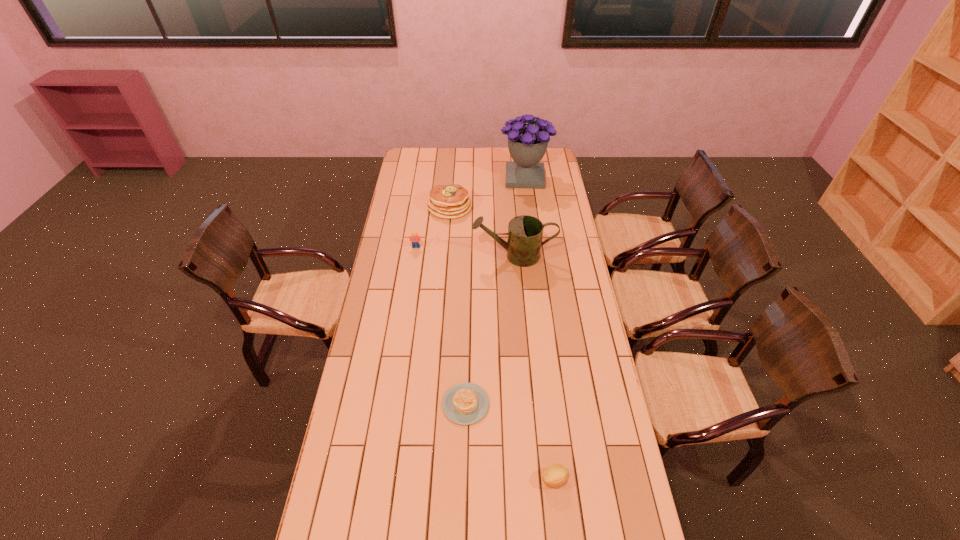
Identify the location of object located at the far edge. (527, 143).

Image resolution: width=960 pixels, height=540 pixels. Find the location of `object that is at the left edge`. object that is at the left edge is located at coordinates point(415,239).

Where is `bouquet at the right edge`? The height and width of the screenshot is (540, 960). bouquet at the right edge is located at coordinates (527, 143).

Image resolution: width=960 pixels, height=540 pixels. Find the location of `watering can located in the right edge section of the desktop`. watering can located in the right edge section of the desktop is located at coordinates (525, 232).

Where is `object at the far right corner`? This screenshot has width=960, height=540. object at the far right corner is located at coordinates (527, 143).

The height and width of the screenshot is (540, 960). In order to click on vacant space at the far edge of the desktop in this screenshot , I will do `click(433, 163)`.

Image resolution: width=960 pixels, height=540 pixels. What are the coordinates of `vacant space at the left edge` in the screenshot? It's located at pos(424,194).

Locate an element on the screen. This screenshot has width=960, height=540. free space at the right edge of the desktop is located at coordinates (562, 270).

The image size is (960, 540). What are the coordinates of `free location at the far left corner` in the screenshot? It's located at (409, 153).

The width and height of the screenshot is (960, 540). I want to click on unoccupied position between the farther pancake and the second shortest object, so click(x=502, y=343).